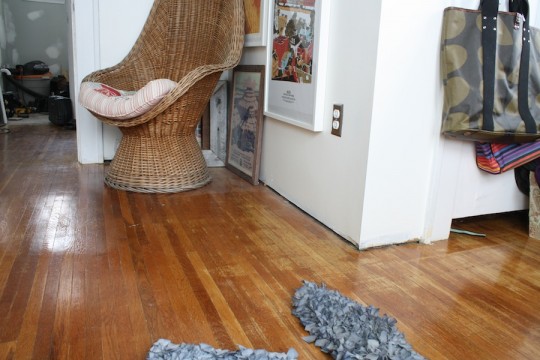
Locate an element on the screen. light gray wall is located at coordinates (31, 37).